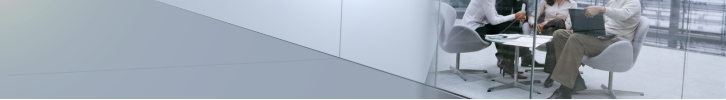
At what (x,y) coordinates should I click in order to perform the action: click on chairs. Please return your answer as a coordinate pair (x, y). This screenshot has height=100, width=726. Looking at the image, I should click on (616, 56), (526, 27), (462, 39).